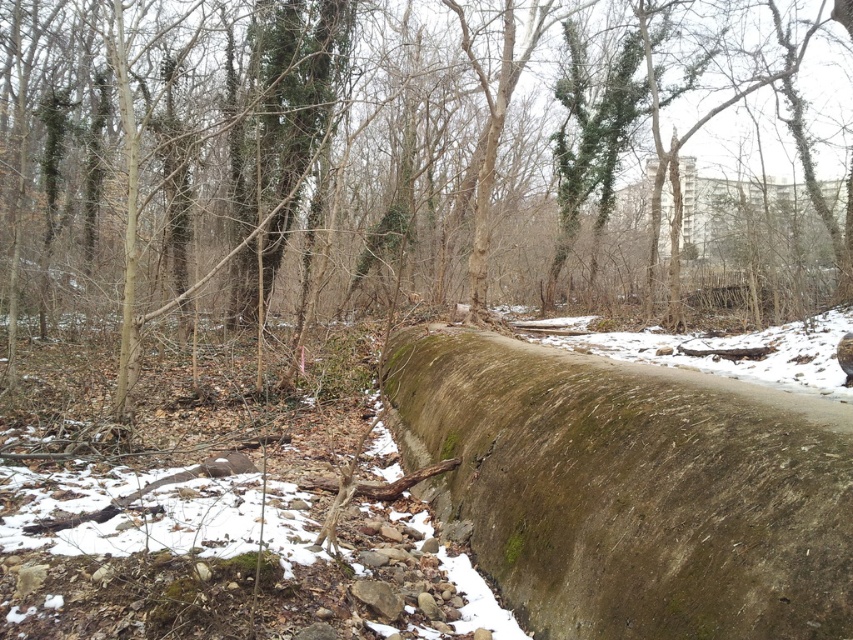
You are an environmental scientist examining the green mossy wall at center and the green mossy concrete log at center in the winter scene. Based on their appearance, which object do you think has a larger surface area for moss growth?

The green mossy wall at center might have a larger surface area for moss growth than the green mossy concrete log at center because it is wider.